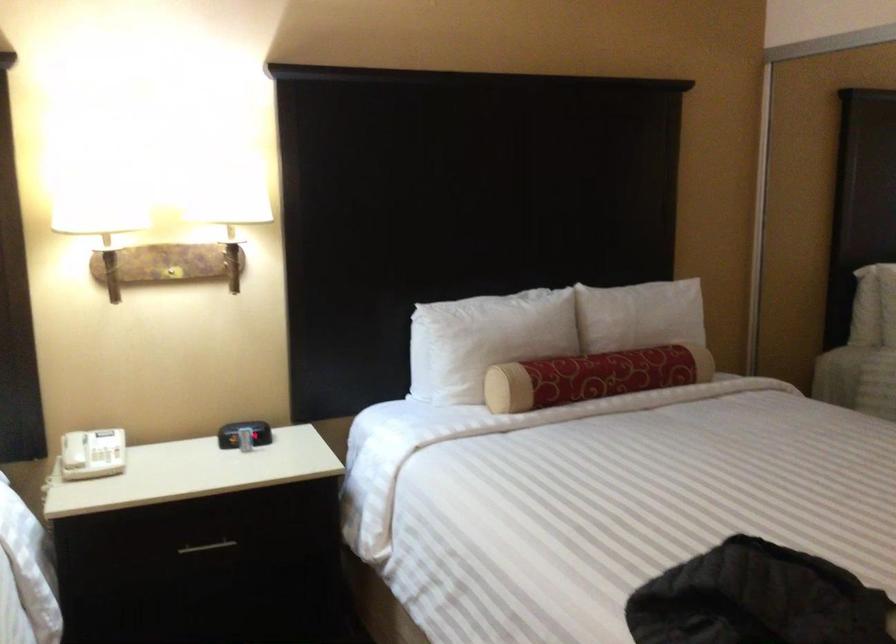
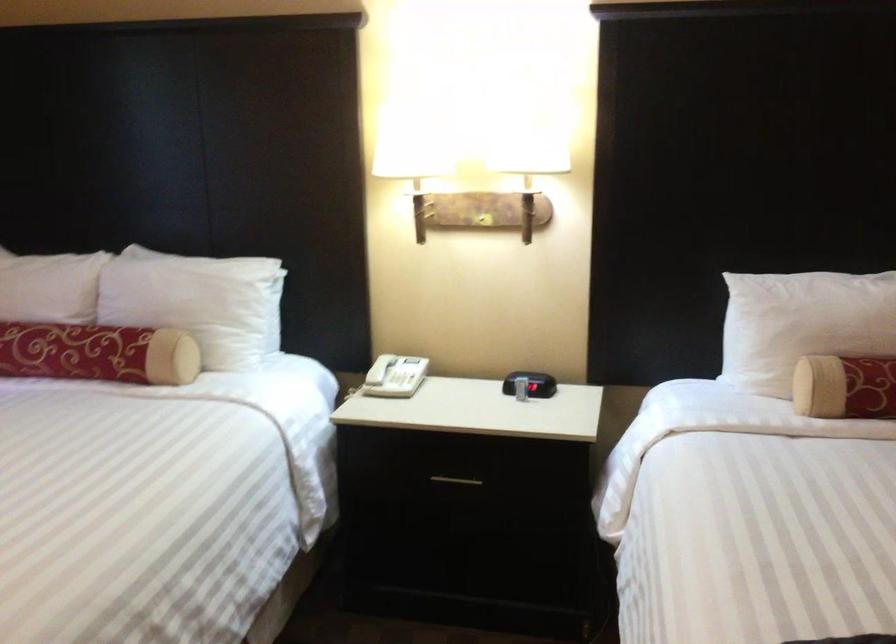
Where in the second image is the point corresponding to point (71, 451) from the first image?

(380, 368)